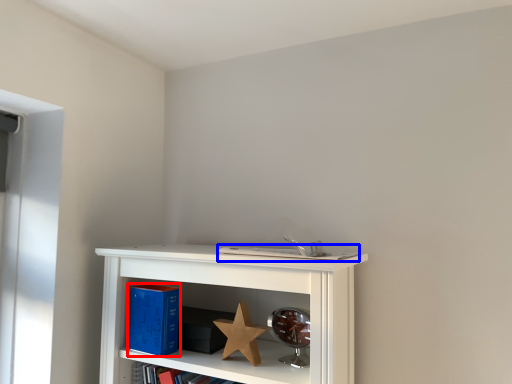
Question: Which point is closer to the camera, paperback book (highlighted by a red box) or book (highlighted by a blue box)?

Choices:
 (A) paperback book
 (B) book

Answer: (B)